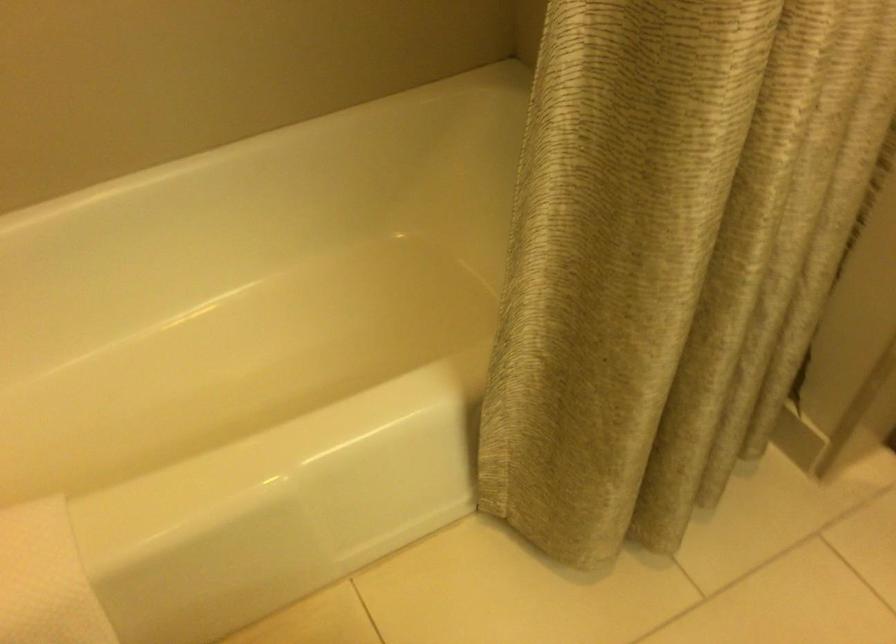
What are the coordinates of `patterned shower curtain` in the screenshot? It's located at (643, 254).